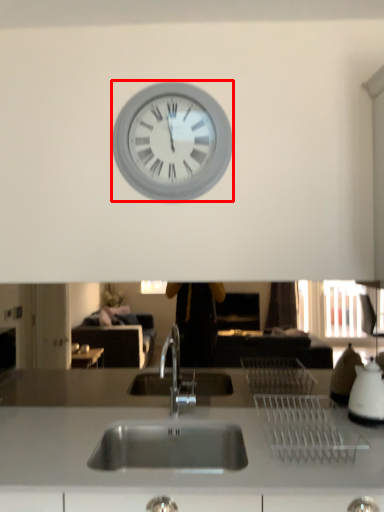
Question: From the image, what is the correct spatial relationship of wall clock (annotated by the red box) in relation to appliance?

Choices:
 (A) left
 (B) right

Answer: (A)